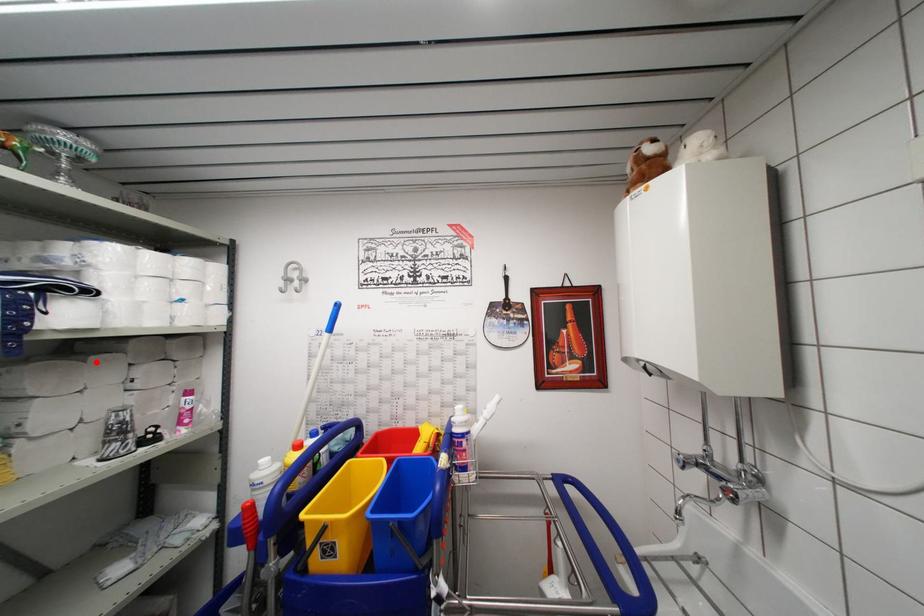
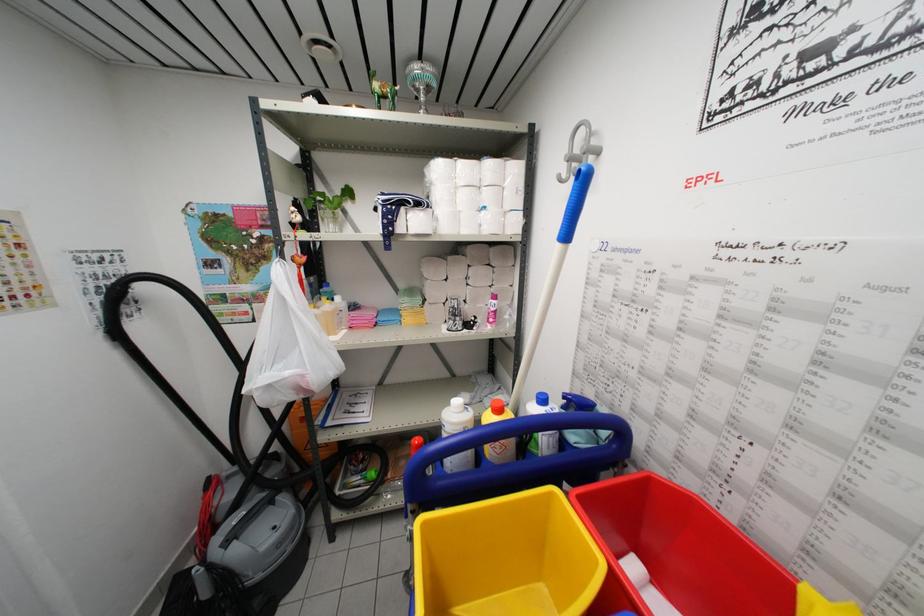
In the second image, find the point that corresponds to the highlighted location in the first image.

(453, 262)